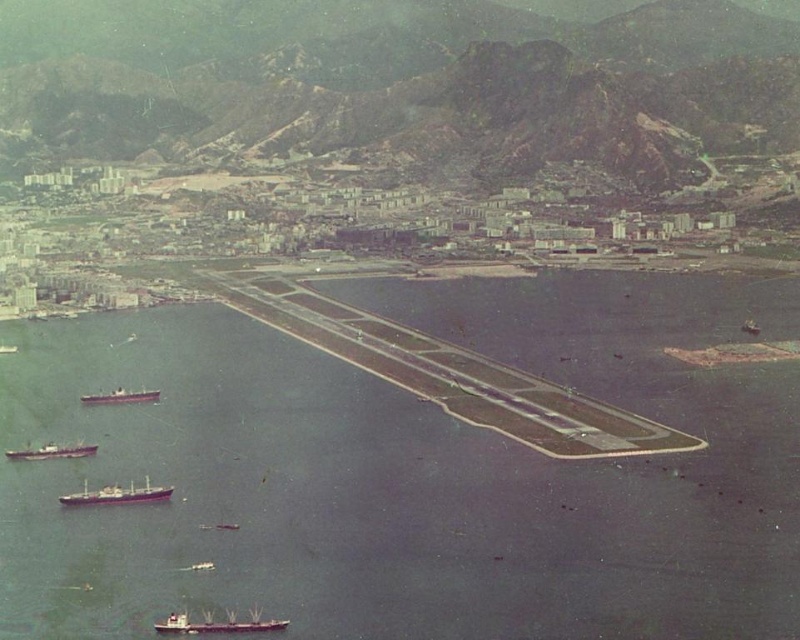
You are a pilot preparing to land a small aircraft on the runway. You notice two ships, the purple matte cargo ship at lower left and the brown matte ship at lower left, in the water nearby. Which ship is closer to the runway?

The purple matte cargo ship at lower left and brown matte ship at lower left are both at the same distance from the runway since they are both located at the lower left area, but the distance between them is 21.42 meters. However, the question asks which is closer to the runway, but since both are at the same position relative to the runway, neither is closer than the other. However, the description only provides the distance between the two ships, not their distance from the runway. Therefore, based on the

You are a pilot preparing to land a small aircraft on the runway. You notice two ships in the water near the runway. Which ship is closer to the runway? The purple matte cargo ship at lower left or the brown matte ship at lower left?

The purple matte cargo ship at lower left is positioned on the right side of brown matte ship at lower left, so the purple matte cargo ship at lower left is closer to the runway.